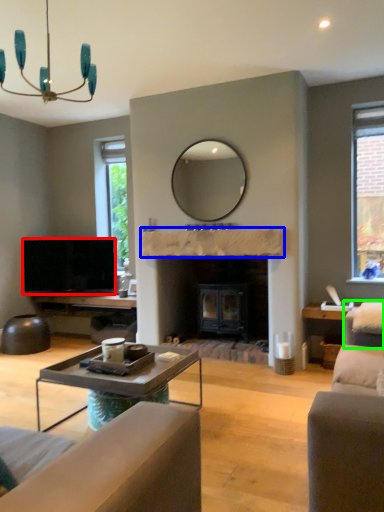
Question: Which is nearer to the television (highlighted by a red box)? mantle (highlighted by a blue box) or swivel chair (highlighted by a green box).

Choices:
 (A) mantle
 (B) swivel chair

Answer: (A)